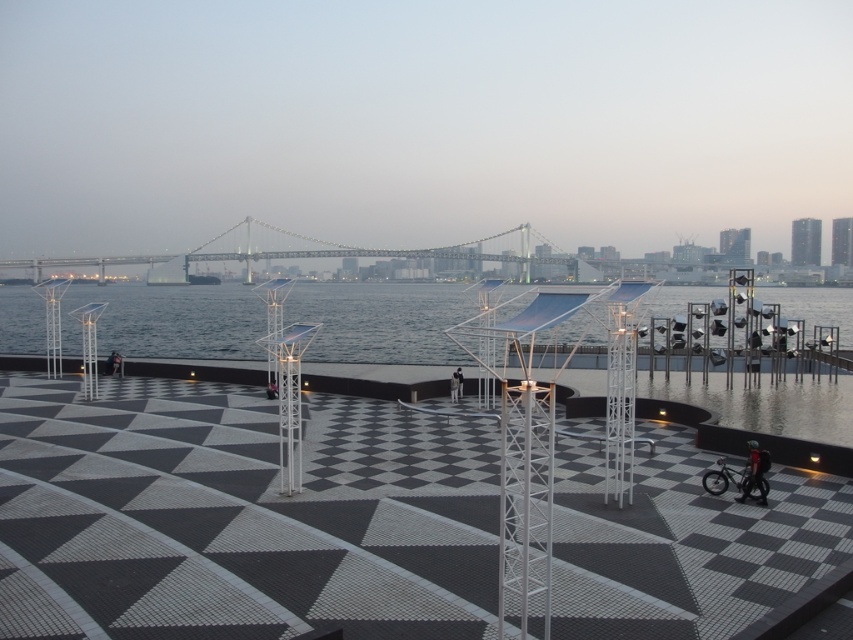
You are a photographer standing at the waterfront. You want to capture a photo of the metallic gray bridge at center and the transparent glass water at center. Based on their positions, which object should you focus on first if you want both to be in the same frame?

The transparent glass water at center is located below the metallic gray bridge at center, so you should focus on the metallic gray bridge at center first to ensure both are in the same frame.

You are a photographer setting up a tripod in the middle of the black textured tiles at center. You need to place a dark blue fabric jacket at lower right so that it is visible in the reflection of the water. Considering their heights, will the jacket be visible in the reflection?

The black textured tiles at center is shorter than dark blue fabric jacket at lower right. Since the jacket is taller, its reflection would likely be visible in the water, provided it is positioned within the reflective area.

You are a delivery person carrying a dark blue fabric jacket at lower right and need to place it on the black textured tiles at center. Can you fit the jacket on the tiles without folding it?

The black textured tiles at center might be wider than dark blue fabric jacket at lower right, so it is possible that the jacket can fit without folding, but there is uncertainty due to the comparative size mentioned.